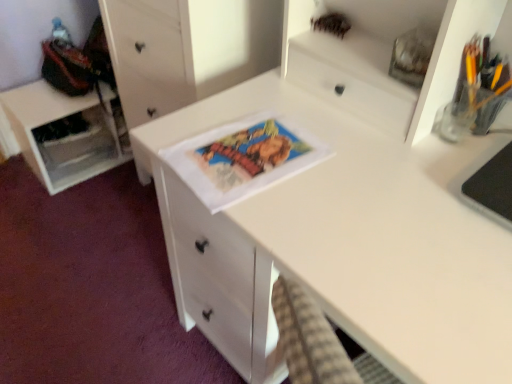
Find the location of a particular element. Image resolution: width=512 pixels, height=384 pixels. vacant space situated above matte paper comic book at center (from a real-world perspective) is located at coordinates (248, 152).